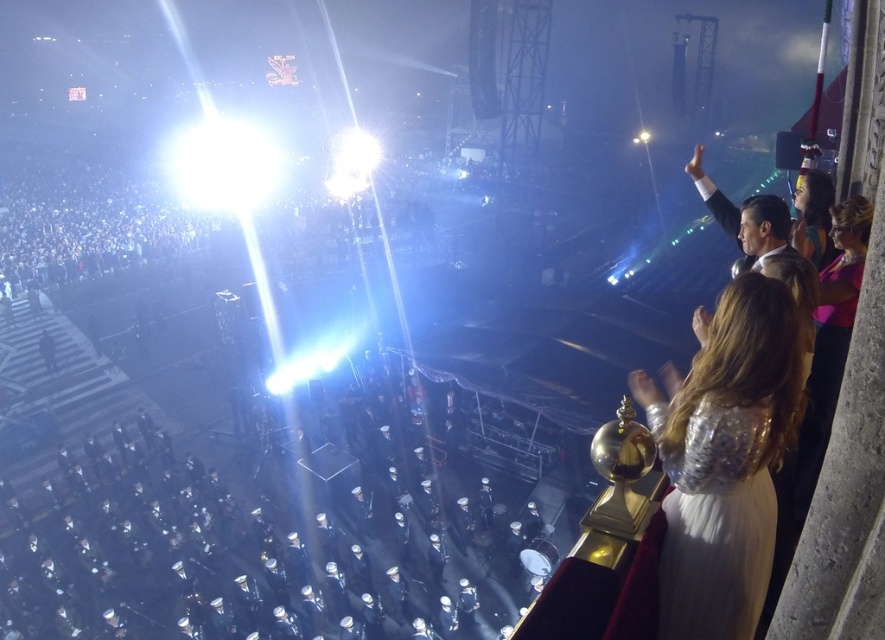
You are standing at the front of the event venue and see two points in the crowd, one at point (730, 380) and another at point (704, 493). Which point is closer to you?

Point (730, 380) is closer to the viewer than point (704, 493).

You are a photographer at the event and want to capture a photo of both the shiny silver dress at upper right and the silver sequined dress at right in the same frame. The camera you are using has a maximum focus range of 3 inches. Can you fit both dresses in the frame without moving the camera?

The distance between the shiny silver dress at upper right and the silver sequined dress at right is 2.91 inches, which is within the camera maximum focus range of 3 inches. Therefore, you can fit both dresses in the frame without moving the camera.

You are a photographer at the event and want to capture both the shiny silver dress at upper right and the silver sequined dress at right in a single frame. Which dress should you focus on to ensure both are visible without zooming in or out?

The shiny silver dress at upper right is wider than the silver sequined dress at right, so focusing on the shiny silver dress at upper right would allow both to fit in the frame since it occupies more space.